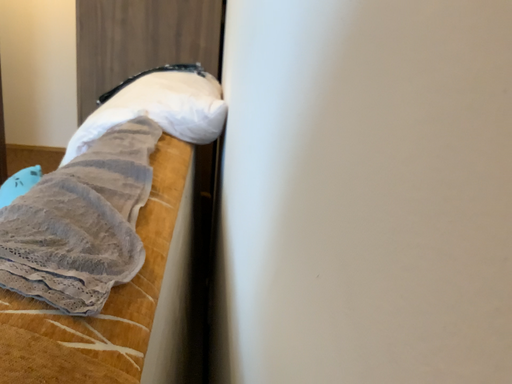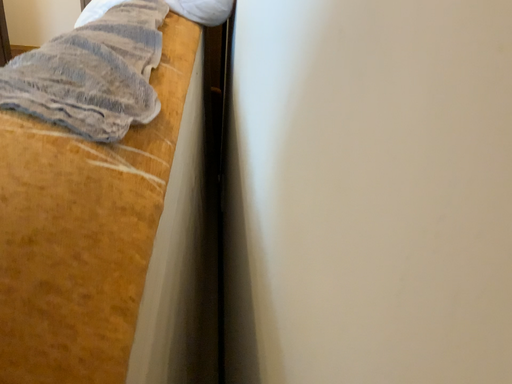
Question: How did the camera likely rotate when shooting the video?

Choices:
 (A) rotated downward
 (B) rotated upward

Answer: (A)